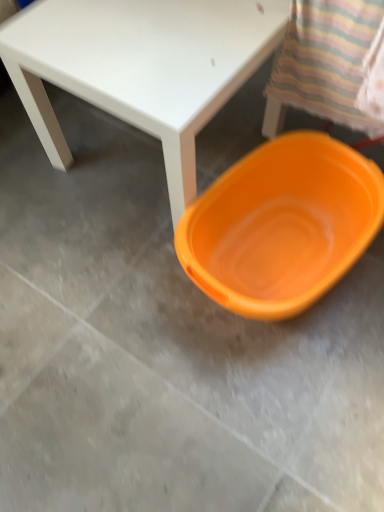
Question: Considering the positions of orange plastic basin at lower right and matte white table at center in the image, is orange plastic basin at lower right wider or thinner than matte white table at center?

Choices:
 (A) thin
 (B) wide

Answer: (B)

Question: Based on their sizes in the image, would you say orange plastic basin at lower right is bigger or smaller than matte white table at center?

Choices:
 (A) big
 (B) small

Answer: (B)

Question: Is orange plastic basin at lower right inside the boundaries of matte white table at center, or outside?

Choices:
 (A) outside
 (B) inside

Answer: (A)

Question: Is matte white table at center inside the boundaries of orange plastic basin at lower right, or outside?

Choices:
 (A) outside
 (B) inside

Answer: (A)

Question: Considering the positions of matte white table at center and orange plastic basin at lower right in the image, is matte white table at center taller or shorter than orange plastic basin at lower right?

Choices:
 (A) short
 (B) tall

Answer: (B)

Question: From a real-world perspective, is matte white table at center positioned above or below orange plastic basin at lower right?

Choices:
 (A) above
 (B) below

Answer: (A)

Question: Considering their positions, is matte white table at center located in front of or behind orange plastic basin at lower right?

Choices:
 (A) behind
 (B) front

Answer: (B)